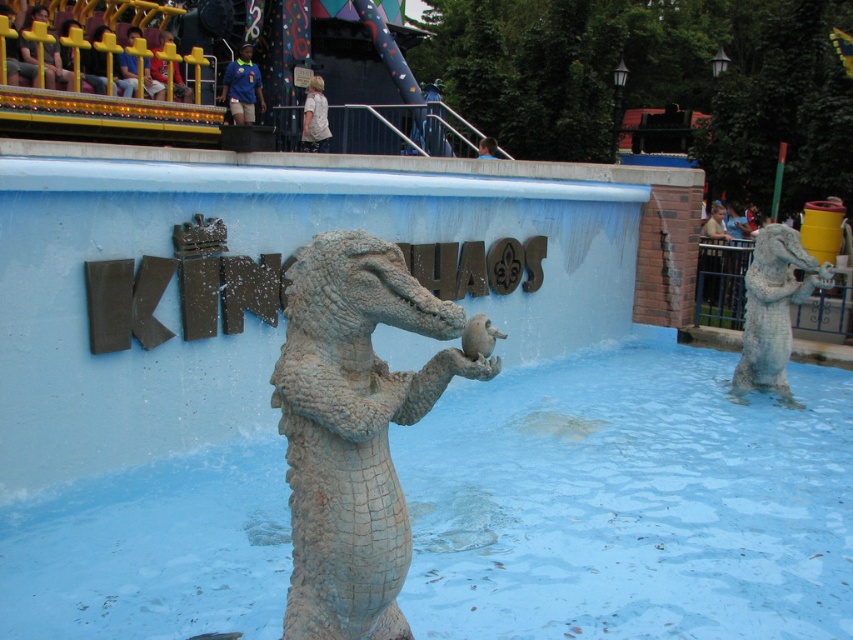
Question: Which object is farther from the camera taking this photo?

Choices:
 (A) gray stone statue at center
 (B) matte gray statue at center

Answer: (A)

Question: Which of the following is the closest to the observer?

Choices:
 (A) gray stone statue at center
 (B) gray stone crocodile at center
 (C) matte gray statue at center

Answer: (B)

Question: Is gray stone statue at center to the right of matte gray statue at center from the viewer's perspective?

Choices:
 (A) no
 (B) yes

Answer: (B)

Question: Can you confirm if gray stone statue at center is positioned to the left of matte gray statue at center?

Choices:
 (A) yes
 (B) no

Answer: (B)

Question: Can you confirm if gray stone crocodile at center is wider than matte gray statue at center?

Choices:
 (A) no
 (B) yes

Answer: (B)

Question: Considering the real-world distances, which object is closest to the matte gray statue at center?

Choices:
 (A) gray stone statue at center
 (B) gray stone crocodile at center

Answer: (B)